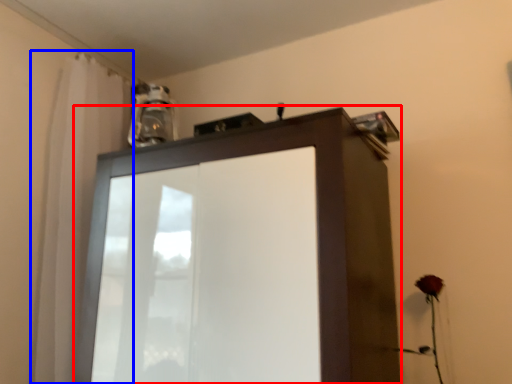
Question: Which of the following is the farthest to the observer, cupboard (highlighted by a red box) or shower curtain (highlighted by a blue box)?

Choices:
 (A) cupboard
 (B) shower curtain

Answer: (B)